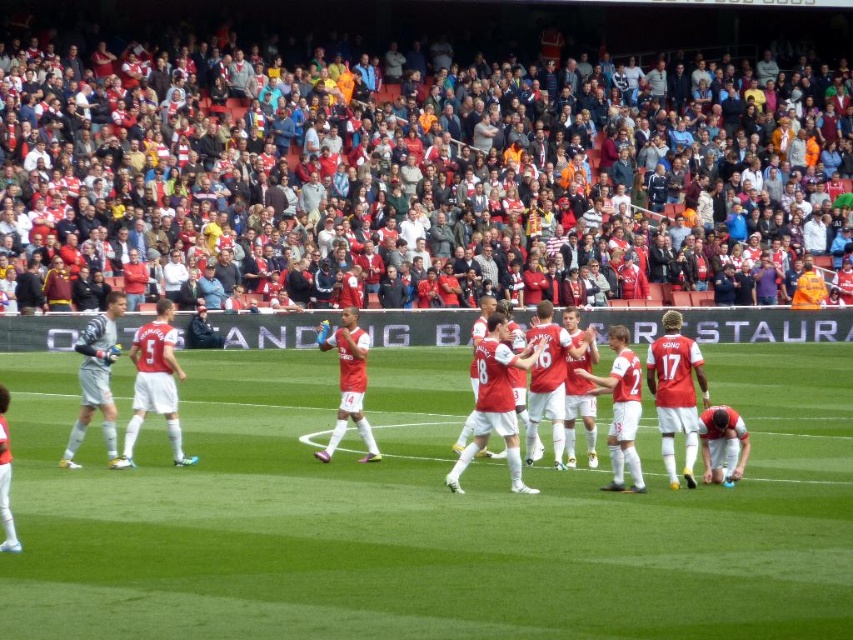
Question: In this image, where is green grass football field at center located relative to matte red jersey at center?

Choices:
 (A) above
 (B) below

Answer: (B)

Question: Considering the relative positions of red fabric crowd at upper center and red matte jersey at center in the image provided, where is red fabric crowd at upper center located with respect to red matte jersey at center?

Choices:
 (A) below
 (B) above

Answer: (B)

Question: Is green grass football field at center positioned behind red matte jersey at center?

Choices:
 (A) yes
 (B) no

Answer: (B)

Question: Which object appears closest to the camera in this image?

Choices:
 (A) matte white jersey at left
 (B) matte red jersey at center
 (C) green grass football field at center

Answer: (C)

Question: Among these objects, which one is nearest to the camera?

Choices:
 (A) matte white jersey at left
 (B) red fabric crowd at upper center

Answer: (A)

Question: Which of the following is the closest to the observer?

Choices:
 (A) (103, 416)
 (B) (344, 380)
 (C) (314, 61)

Answer: (A)